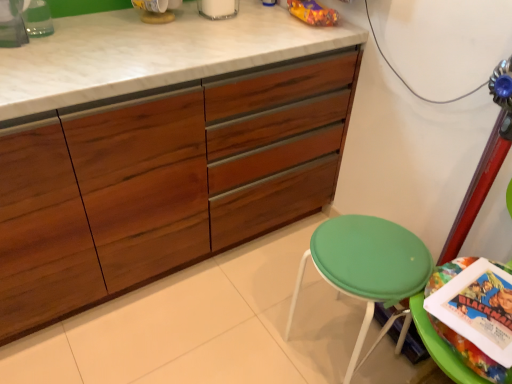
The image size is (512, 384). I want to click on vacant space behind green fabric stool at lower right, so click(x=296, y=276).